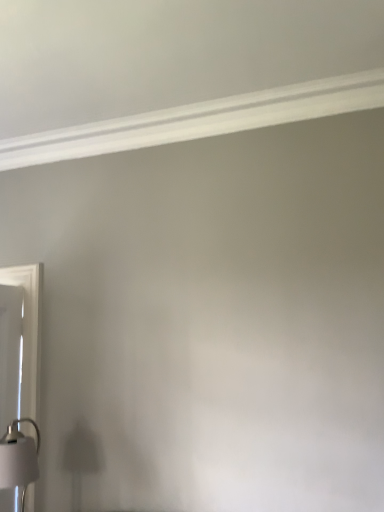
Question: Should I look upward or downward to see white glossy light fixture at lower left?

Choices:
 (A) up
 (B) down

Answer: (B)